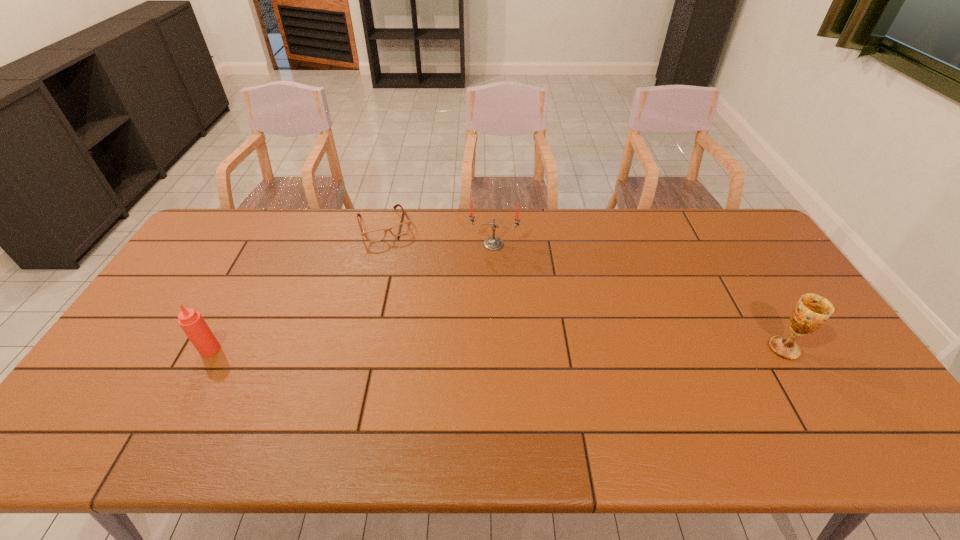
Find the location of a particular element. Image resolution: width=960 pixels, height=540 pixels. free space located 0.320m on the front-facing side of the second object from left to right is located at coordinates (422, 307).

This screenshot has height=540, width=960. Identify the location of vacant space positioned on the front-facing side of the second object from left to right. (426, 316).

Where is `free space located 0.160m on the front-facing side of the second object from left to right`? Image resolution: width=960 pixels, height=540 pixels. free space located 0.160m on the front-facing side of the second object from left to right is located at coordinates (406, 272).

I want to click on candle that is at the far edge, so click(493, 243).

Locate an element on the screen. The height and width of the screenshot is (540, 960). spectacles that is at the far edge is located at coordinates (400, 229).

This screenshot has width=960, height=540. In order to click on object present at the right edge in this screenshot , I will do `click(812, 311)`.

This screenshot has height=540, width=960. What are the coordinates of `vacant region at the far edge of the desktop` in the screenshot? It's located at (644, 213).

Where is `vacant area at the near edge of the desktop`? The height and width of the screenshot is (540, 960). vacant area at the near edge of the desktop is located at coordinates (637, 386).

You are a GUI agent. You are given a task and a screenshot of the screen. Output one action in this format:
    pyautogui.click(x=<x>, y=<y>)
    Task: Click on the vacant space at the right edge of the desktop
    
    Given the screenshot: What is the action you would take?
    pyautogui.click(x=741, y=263)

Locate an element on the screen. This screenshot has width=960, height=540. free space at the near left corner of the desktop is located at coordinates (132, 389).